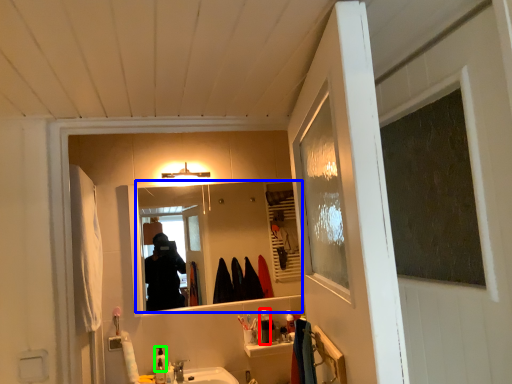
Question: Estimate the real-world distances between objects in this image. Which object is farther from toiletry (highlighted by a red box), mirror (highlighted by a blue box) or toiletry (highlighted by a green box)?

Choices:
 (A) mirror
 (B) toiletry

Answer: (A)